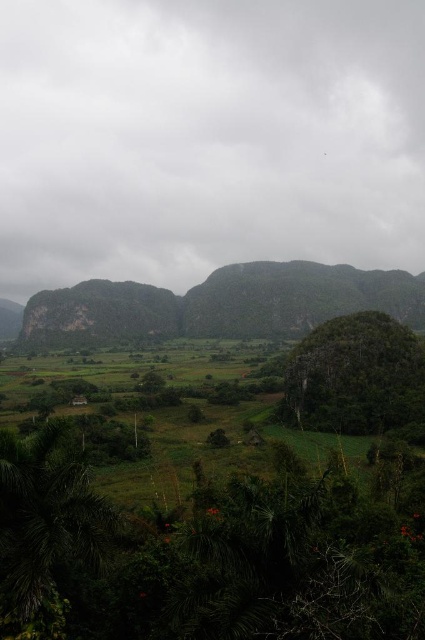
Question: Which object is farther from the camera taking this photo?

Choices:
 (A) rocky gray mountain at center
 (B) green leafy tree at lower right

Answer: (A)

Question: Considering the relative positions of green leafy tree at lower left and green leafy tree at lower right in the image provided, where is green leafy tree at lower left located with respect to green leafy tree at lower right?

Choices:
 (A) left
 (B) right

Answer: (A)

Question: Which object is closer to the camera taking this photo?

Choices:
 (A) green leafy tree at lower right
 (B) green leafy tree at lower left
 (C) green grassy field at lower center

Answer: (C)

Question: Which object is closer to the camera taking this photo?

Choices:
 (A) rocky gray mountain at center
 (B) green leafy tree at lower right
 (C) green leafy tree at lower left

Answer: (C)

Question: Does green grassy field at lower center come in front of green leafy tree at lower right?

Choices:
 (A) yes
 (B) no

Answer: (A)

Question: Is rocky gray mountain at center smaller than green leafy tree at lower right?

Choices:
 (A) no
 (B) yes

Answer: (A)